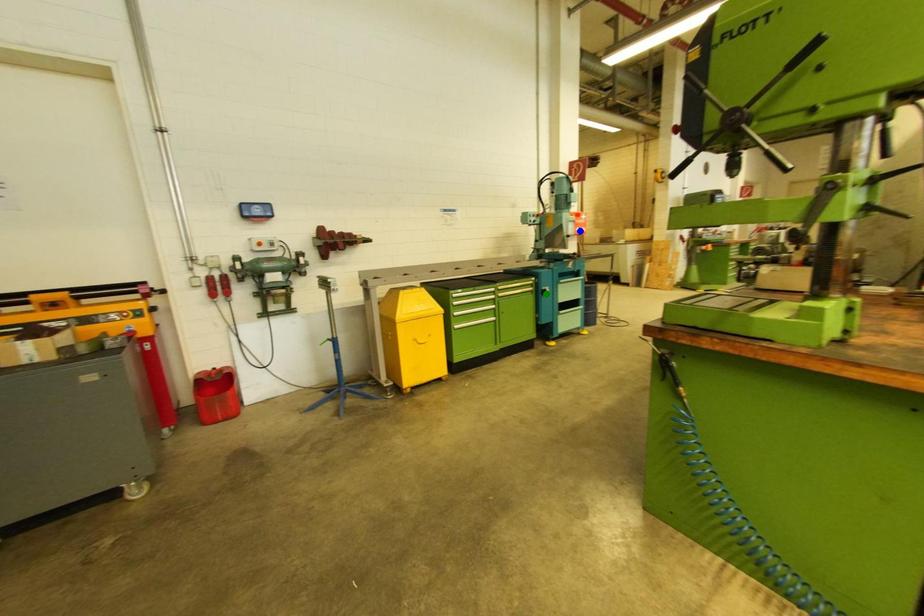
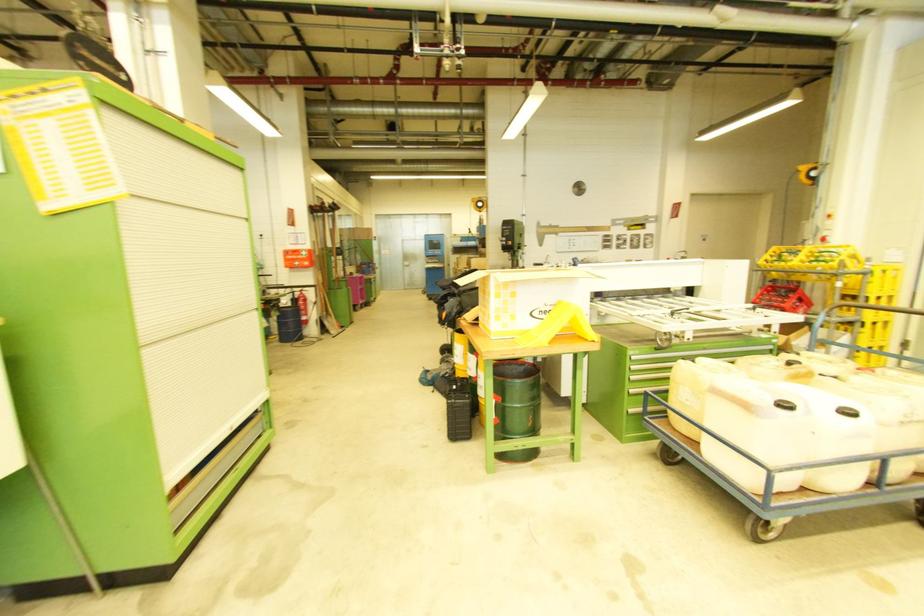
I am providing you with two images of the same scene from different viewpoints. Three points are marked in image1. Which point corresponds to a part or object that is occluded in image2?In image1, three points are marked. Which of them correspond to a part or object that is occluded in image2?Among the three points shown in image1, which one corresponds to a part or object that is no longer visible due to occlusion in image2?

green point